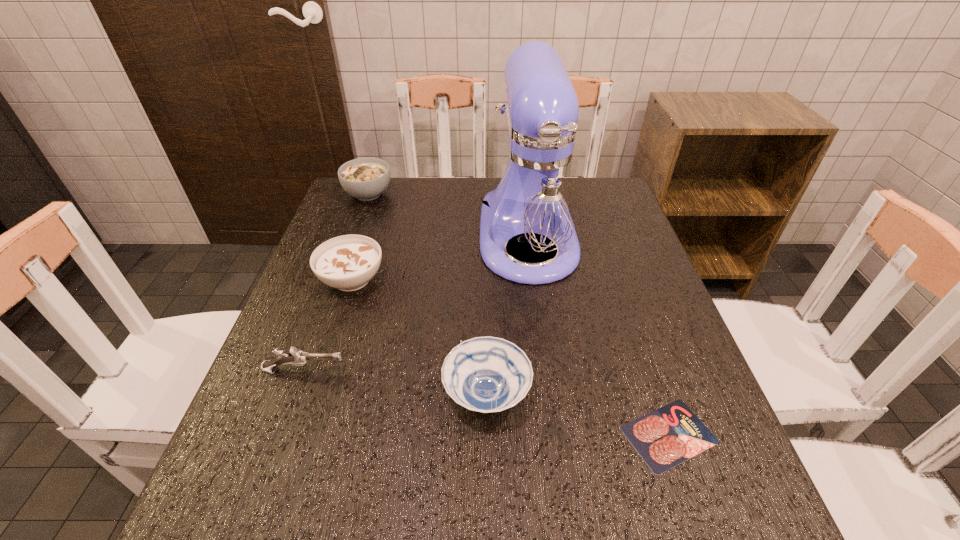
Locate an element on the screen. vacant space located on the left of the nearest soup bowl is located at coordinates (299, 395).

At what (x,y) coordinates should I click in order to perform the action: click on vacant space located aimed along the barrel of the gun. Please return your answer as a coordinate pair (x, y). Looking at the image, I should click on (509, 370).

This screenshot has width=960, height=540. What are the coordinates of `vacant space located on the back of the shortest object` in the screenshot? It's located at (635, 333).

Locate an element on the screen. The image size is (960, 540). mixer located in the far edge section of the desktop is located at coordinates (536, 197).

Identify the location of soup bowl positioned at the far edge. This screenshot has width=960, height=540. (366, 179).

This screenshot has height=540, width=960. What are the coordinates of `gun located in the left edge section of the desktop` in the screenshot? It's located at (295, 357).

Where is `mixer that is positioned at the right edge`? The height and width of the screenshot is (540, 960). mixer that is positioned at the right edge is located at coordinates (536, 197).

Locate an element on the screen. The image size is (960, 540). salami located in the right edge section of the desktop is located at coordinates (664, 438).

Find the location of a particular element. The height and width of the screenshot is (540, 960). object located in the far left corner section of the desktop is located at coordinates (366, 179).

At what (x,y) coordinates should I click in order to perform the action: click on object that is at the far right corner. Please return your answer as a coordinate pair (x, y). The image size is (960, 540). Looking at the image, I should click on (536, 197).